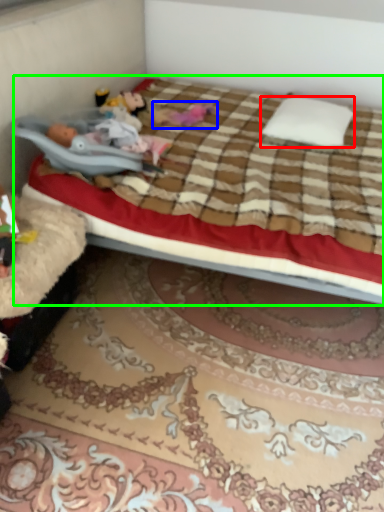
Question: Estimate the real-world distances between objects in this image. Which object is closer to pillow (highlighted by a red box), toy (highlighted by a blue box) or bed (highlighted by a green box)?

Choices:
 (A) toy
 (B) bed

Answer: (B)